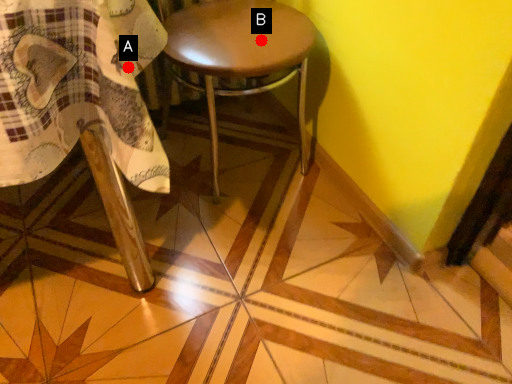
Question: Two points are circled on the image, labeled by A and B beside each circle. Which point appears closest to the camera in this image?

Choices:
 (A) A is closer
 (B) B is closer

Answer: (A)